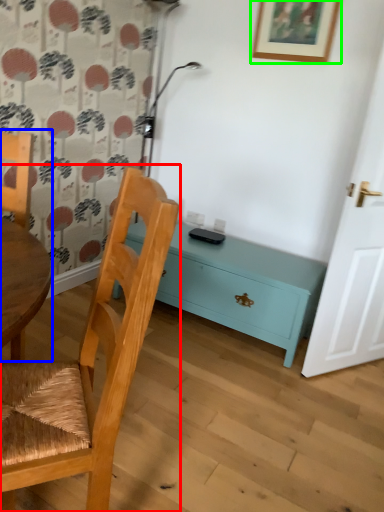
Question: Which object is the closest to the chair (highlighted by a red box)? Choose among these: chair (highlighted by a blue box) or picture frame (highlighted by a green box).

Choices:
 (A) chair
 (B) picture frame

Answer: (A)